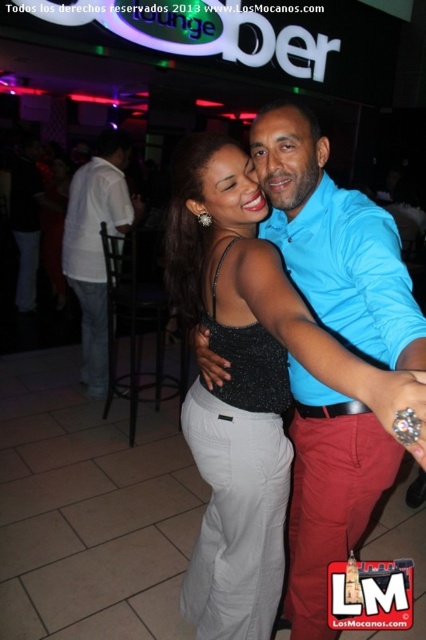
Which is behind, point (204, 449) or point (112, 216)?

Positioned behind is point (112, 216).

Image resolution: width=426 pixels, height=640 pixels. Describe the element at coordinates (238, 483) in the screenshot. I see `sparkly black tank top at center` at that location.

Find the location of a particular element. This screenshot has height=640, width=426. sparkly black tank top at center is located at coordinates (238, 483).

Based on the photo, who is positioned more to the right, blue cotton shirt at center or sparkly black tank top at center?

From the viewer's perspective, blue cotton shirt at center appears more on the right side.

Locate an element on the screen. This screenshot has width=426, height=640. blue cotton shirt at center is located at coordinates (336, 243).

Is blue cotton shirt at center wider than white cotton shirt at left?

Correct, the width of blue cotton shirt at center exceeds that of white cotton shirt at left.

Between blue cotton shirt at center and white cotton shirt at left, which one has less height?

Standing shorter between the two is blue cotton shirt at center.

Locate an element on the screen. The image size is (426, 640). blue cotton shirt at center is located at coordinates (336, 243).

Image resolution: width=426 pixels, height=640 pixels. Find the location of `blue cotton shirt at center`. blue cotton shirt at center is located at coordinates (336, 243).